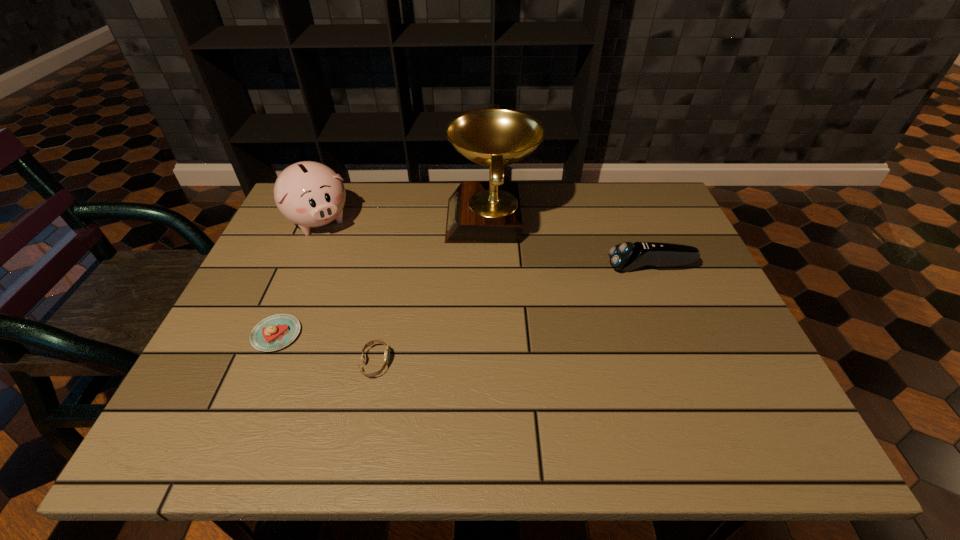
You are a GUI agent. You are given a task and a screenshot of the screen. Output one action in this format:
    pyautogui.click(x=<x>, y=<y>)
    Task: Click on the award
    This screenshot has height=540, width=960.
    Given the screenshot: What is the action you would take?
    pyautogui.click(x=478, y=212)

Image resolution: width=960 pixels, height=540 pixels. In order to click on the tallest object in this screenshot , I will do point(478,212).

I want to click on the second tallest object, so pyautogui.click(x=310, y=194).

Identify the location of the rightmost object. This screenshot has height=540, width=960. (627, 256).

Identify the location of the third shortest object. The height and width of the screenshot is (540, 960). (627, 256).

Find the location of a particular element. the third object from left to right is located at coordinates (387, 350).

The height and width of the screenshot is (540, 960). In order to click on pastry in this screenshot , I will do `click(277, 331)`.

You are a GUI agent. You are given a task and a screenshot of the screen. Output one action in this format:
    pyautogui.click(x=<x>, y=<y>)
    Task: Click on the blank area located on the front-facing side of the fourth object from left to right
    The width and height of the screenshot is (960, 540).
    Given the screenshot: What is the action you would take?
    pyautogui.click(x=392, y=221)

I want to click on vacant space located 0.270m on the front-facing side of the fourth object from left to right, so click(x=354, y=221).

Locate an element on the screen. vacant region located on the front-facing side of the fourth object from left to right is located at coordinates (364, 221).